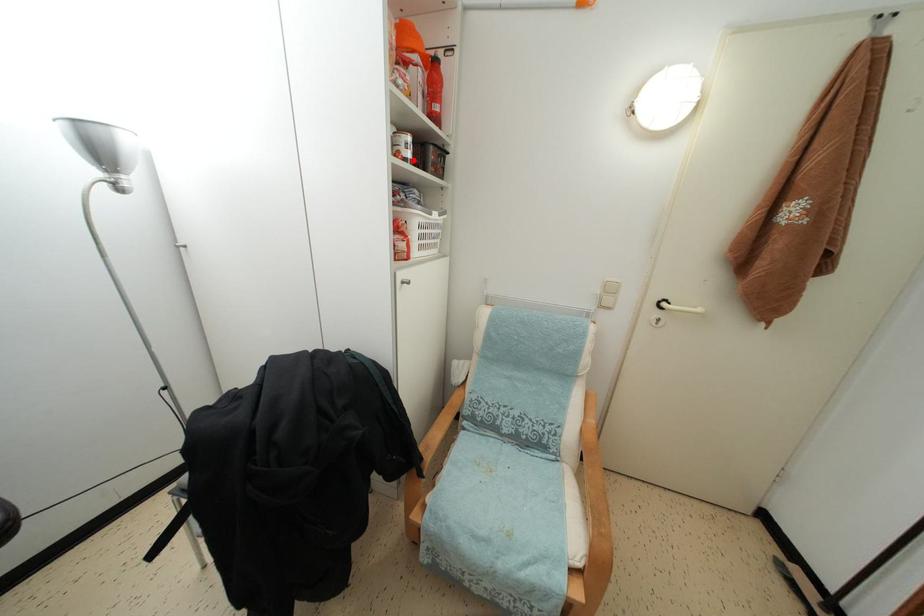
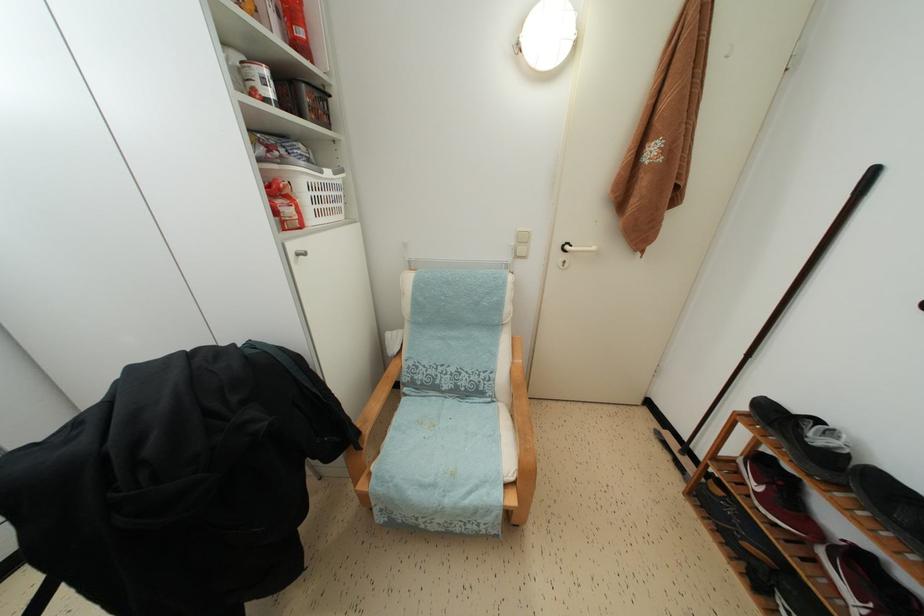
Where in the second image is the point corresponding to the highlighted location from the first image?

(274, 100)